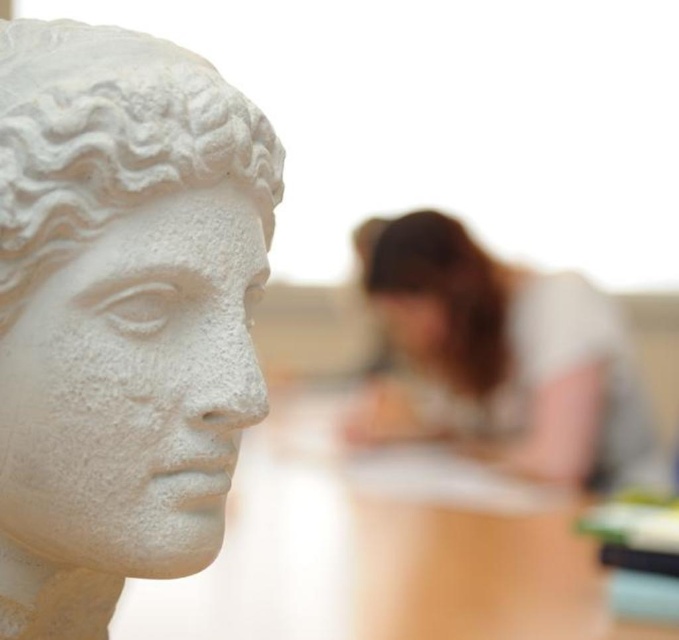
Question: Which is nearer to the smooth brown hair at center?

Choices:
 (A) blurred hair at center
 (B) white marble statue at left

Answer: (A)

Question: Estimate the real-world distances between objects in this image. Which object is farther from the blurred hair at center?

Choices:
 (A) smooth brown hair at center
 (B) white marble statue at left

Answer: (B)

Question: Is white marble statue at left above blurred hair at center?

Choices:
 (A) yes
 (B) no

Answer: (A)

Question: Where is white marble statue at left located in relation to blurred hair at center in the image?

Choices:
 (A) below
 (B) above

Answer: (B)

Question: Among these points, which one is farthest from the camera?

Choices:
 (A) (45, 38)
 (B) (574, 310)

Answer: (B)

Question: Can you confirm if blurred hair at center is smaller than smooth brown hair at center?

Choices:
 (A) no
 (B) yes

Answer: (A)